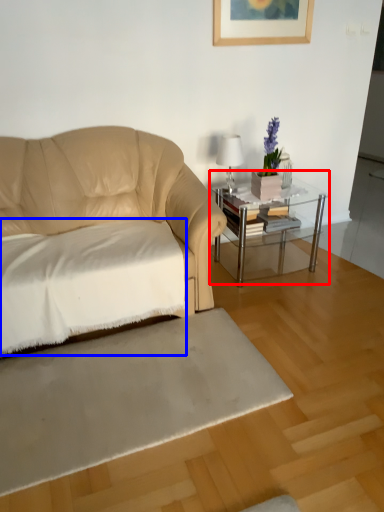
Question: Which object is closer to the camera taking this photo, table (highlighted by a red box) or sheet (highlighted by a blue box)?

Choices:
 (A) table
 (B) sheet

Answer: (B)